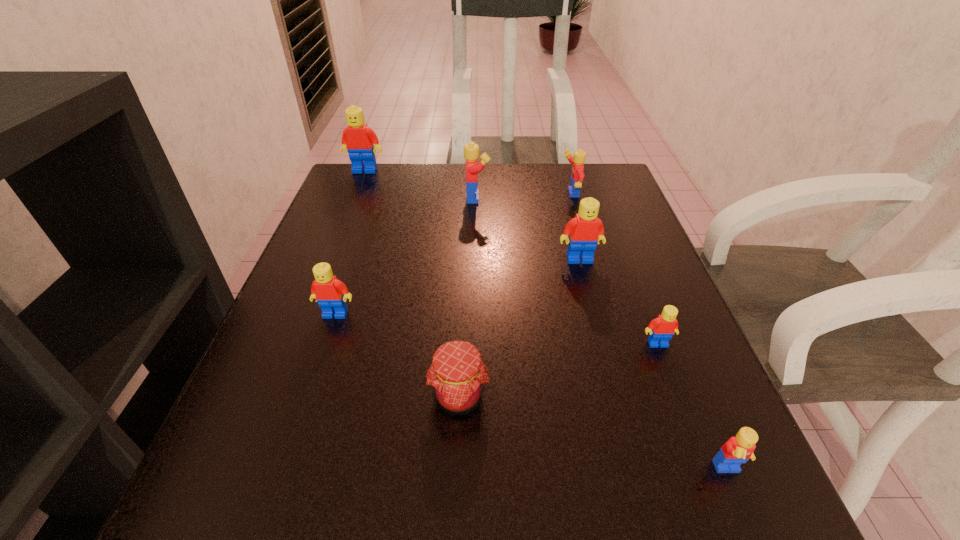
The width and height of the screenshot is (960, 540). What are the coordinates of `jam` in the screenshot? It's located at (457, 375).

Image resolution: width=960 pixels, height=540 pixels. I want to click on the third nearest object, so click(661, 329).

The width and height of the screenshot is (960, 540). I want to click on the smallest red Lego, so click(661, 329).

You are a GUI agent. You are given a task and a screenshot of the screen. Output one action in this format:
    pyautogui.click(x=<x>, y=<y>)
    Task: Click on the nearest yellow Lego
    The height and width of the screenshot is (540, 960).
    Given the screenshot: What is the action you would take?
    pyautogui.click(x=737, y=450)

Where is `the smallest yellow Lego`? The height and width of the screenshot is (540, 960). the smallest yellow Lego is located at coordinates (737, 450).

The image size is (960, 540). What are the coordinates of `vacant space situated 0.240m on the face of the tallest Lego` in the screenshot? It's located at (344, 226).

Where is `vacant area situated 0.310m on the face of the leftmost yellow Lego`? vacant area situated 0.310m on the face of the leftmost yellow Lego is located at coordinates (612, 198).

Find the location of `free space located on the face of the second red Lego from right to left`. free space located on the face of the second red Lego from right to left is located at coordinates (602, 348).

The image size is (960, 540). In order to click on vacant space located 0.170m on the face of the second yellow Lego from left to right in this screenshot , I will do `click(494, 194)`.

I want to click on free space located on the face of the second yellow Lego from left to right, so click(424, 194).